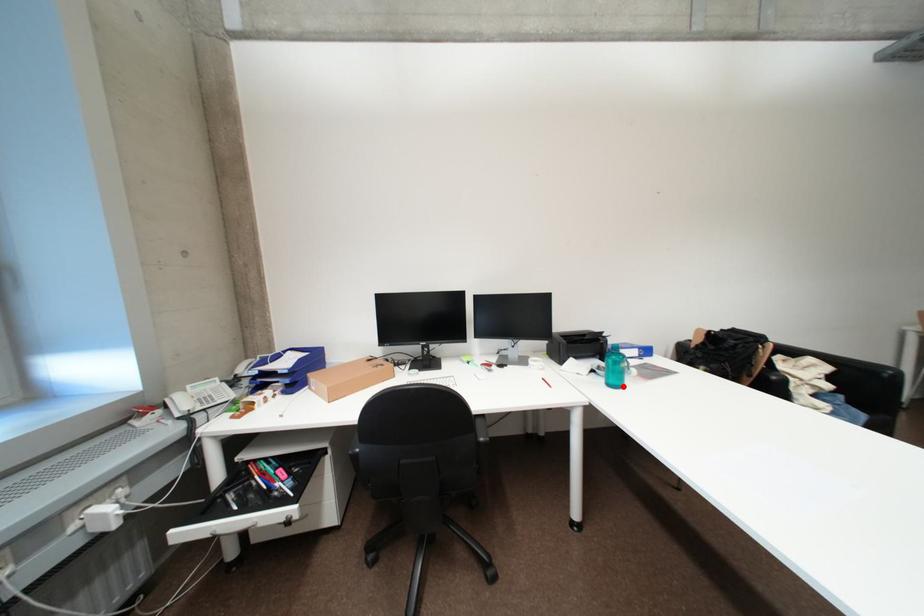
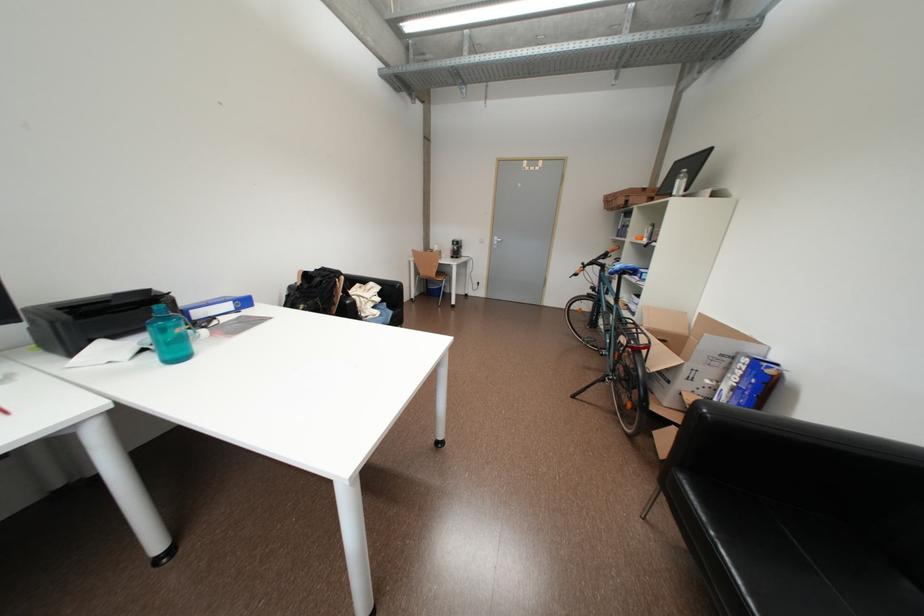
Where in the second image is the point corresponding to the highlighted location from the first image?

(186, 360)